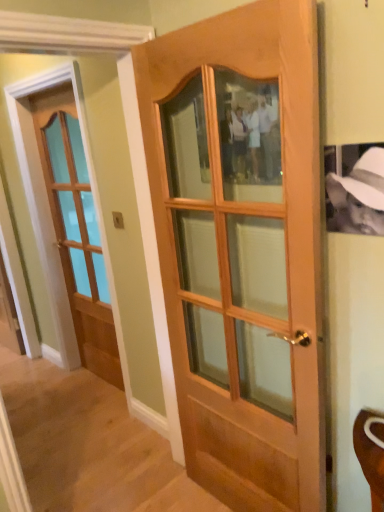
Question: Which direction should I rotate to face wooden door at center, acting as the first door starting from the right, — up or down?

Choices:
 (A) down
 (B) up

Answer: (A)

Question: From the image's perspective, is matte wooden door at left, the 1th door viewed from the left, on wooden door at center, acting as the first door starting from the right?

Choices:
 (A) no
 (B) yes

Answer: (B)

Question: Can you confirm if matte wooden door at left, placed as the second door when sorted from right to left, is smaller than wooden door at center, which appears as the 2th door when viewed from the back?

Choices:
 (A) yes
 (B) no

Answer: (A)

Question: Does matte wooden door at left, which ranks as the second door in front-to-back order, appear on the left side of wooden door at center, the 2th door from the left?

Choices:
 (A) yes
 (B) no

Answer: (A)

Question: Can you confirm if matte wooden door at left, the 1th door viewed from the left, is bigger than wooden door at center, acting as the first door starting from the right?

Choices:
 (A) yes
 (B) no

Answer: (B)

Question: Is matte wooden door at left, which ranks as the second door in front-to-back order, outside wooden door at center, marked as the 1th door in a front-to-back arrangement?

Choices:
 (A) yes
 (B) no

Answer: (A)

Question: Is matte wooden door at left, which ranks as the second door in front-to-back order, positioned far away from wooden door at center, marked as the 1th door in a front-to-back arrangement?

Choices:
 (A) no
 (B) yes

Answer: (B)

Question: Is wooden door at center, which appears as the 2th door when viewed from the back, smaller than matte wooden door at left, the 1th door viewed from the left?

Choices:
 (A) no
 (B) yes

Answer: (A)

Question: Is wooden door at center, acting as the first door starting from the right, directly adjacent to matte wooden door at left, the first door in the back-to-front sequence?

Choices:
 (A) no
 (B) yes

Answer: (A)

Question: Considering the relative sizes of wooden door at center, which appears as the 2th door when viewed from the back, and matte wooden door at left, placed as the second door when sorted from right to left, in the image provided, is wooden door at center, which appears as the 2th door when viewed from the back, wider than matte wooden door at left, placed as the second door when sorted from right to left,?

Choices:
 (A) no
 (B) yes

Answer: (B)

Question: Does wooden door at center, marked as the 1th door in a front-to-back arrangement, come in front of matte wooden door at left, placed as the second door when sorted from right to left?

Choices:
 (A) no
 (B) yes

Answer: (B)

Question: Could you tell me if wooden door at center, marked as the 1th door in a front-to-back arrangement, is facing matte wooden door at left, the first door in the back-to-front sequence?

Choices:
 (A) yes
 (B) no

Answer: (B)

Question: Is wooden door at center, marked as the 1th door in a front-to-back arrangement, looking in the opposite direction of matte wooden door at left, placed as the second door when sorted from right to left?

Choices:
 (A) yes
 (B) no

Answer: (B)

Question: Considering the relative positions of matte wooden door at left, the 1th door viewed from the left, and wooden door at center, the 2th door from the left, in the image provided, is matte wooden door at left, the 1th door viewed from the left, to the left or to the right of wooden door at center, the 2th door from the left,?

Choices:
 (A) right
 (B) left

Answer: (B)